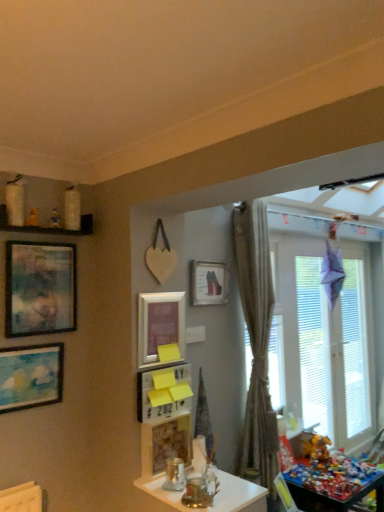
Question: Relative to multicolored plastic toys at lower right, which is counted as the 1th table, starting from the right, is matte blue painting at left, which is the 5th picture frame from right to left, in front or behind?

Choices:
 (A) front
 (B) behind

Answer: (A)

Question: From the image's perspective, relative to multicolored plastic toys at lower right, positioned as the 1th table in back-to-front order, is matte blue painting at left, which is the 5th picture frame from right to left, above or below?

Choices:
 (A) below
 (B) above

Answer: (B)

Question: Estimate the real-world distances between objects in this image. Which object is closer to the silky beige curtain at center?

Choices:
 (A) wooden picture frame at center, which ranks as the fourth picture frame in left-to-right order
 (B) matte blue painting at left, which is the 5th picture frame from right to left
 (C) white glossy jars at upper left
 (D) matte pink picture frame at center, which is the third picture frame from left to right
 (E) matte white picture frame at center, which is counted as the 5th picture frame, starting from the left

Answer: (E)

Question: Considering the real-world distances, which object is farthest from the white glossy jars at upper left?

Choices:
 (A) wooden picture frame at center, which is counted as the second picture frame, starting from the right
 (B) matte blue painting at left, which is the 5th picture frame from right to left
 (C) matte pink picture frame at center, which is the third picture frame from left to right
 (D) matte wooden picture frame at upper left, the 4th picture frame when ordered from right to left
 (E) white frosted glass window at right

Answer: (E)